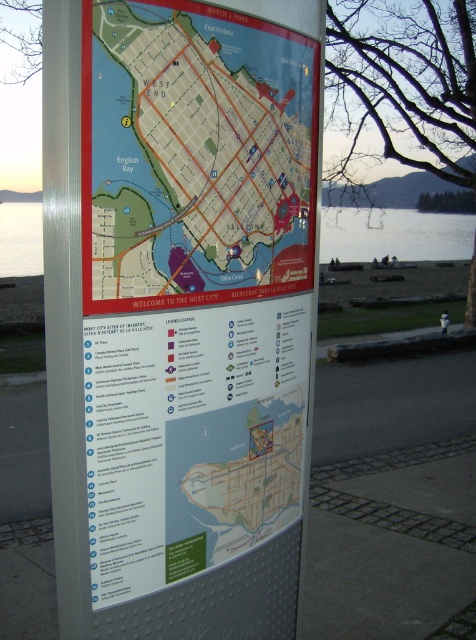
Question: Is matte paper map at center below clear water at lower left?

Choices:
 (A) no
 (B) yes

Answer: (B)

Question: Does matte paper map at center come behind clear water at lower left?

Choices:
 (A) no
 (B) yes

Answer: (A)

Question: Which object appears farthest from the camera in this image?

Choices:
 (A) matte paper map at center
 (B) clear water at lower left

Answer: (B)

Question: Does matte paper map at center appear on the right side of clear water at lower left?

Choices:
 (A) yes
 (B) no

Answer: (B)